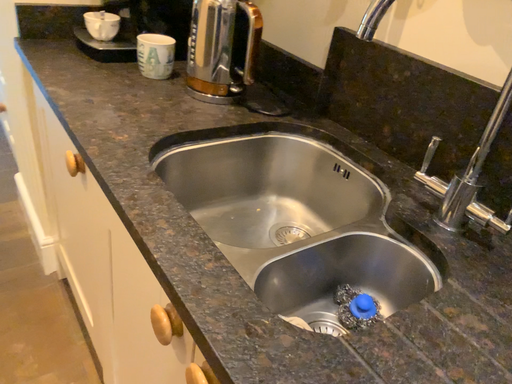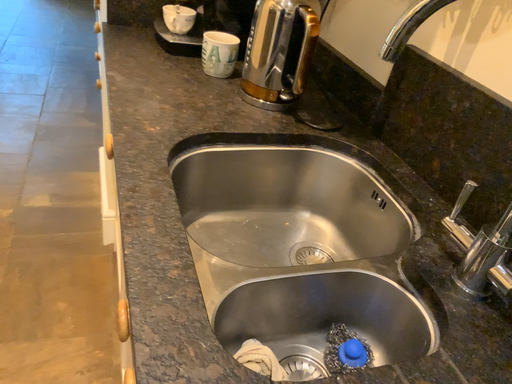
Question: Which way did the camera rotate in the video?

Choices:
 (A) rotated right
 (B) rotated left

Answer: (B)